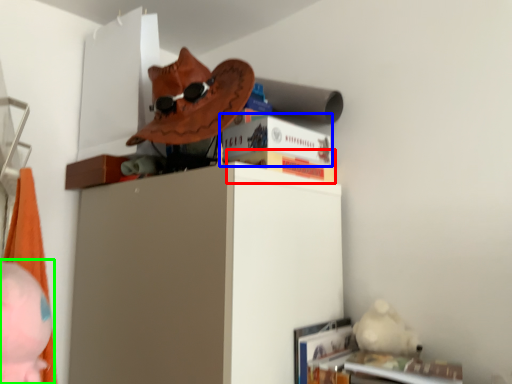
Question: Based on their relative distances, which object is farther from paperback book (highlighted by a red box)? Choose from paperback book (highlighted by a blue box) and person (highlighted by a green box).

Choices:
 (A) paperback book
 (B) person

Answer: (B)